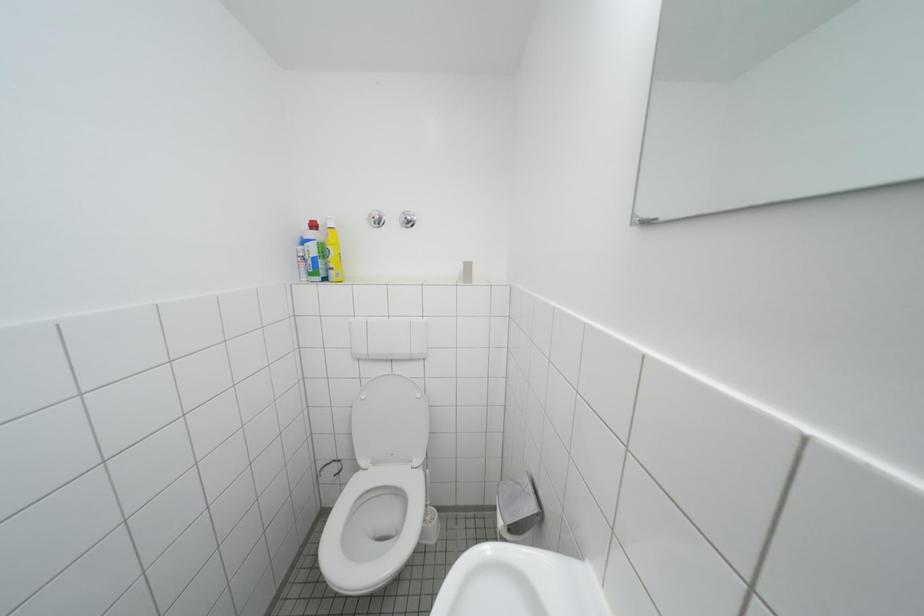
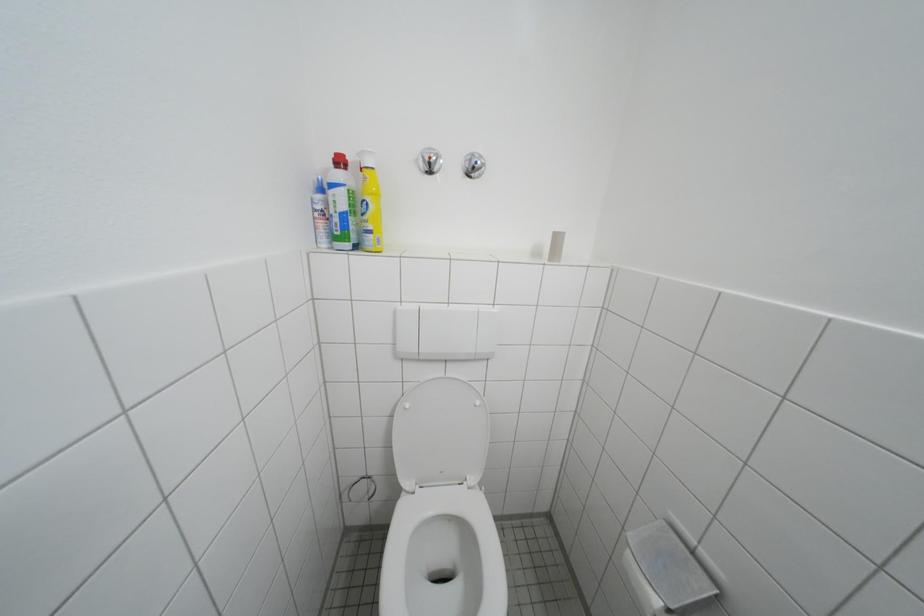
In a continuous first-person perspective shot, in which direction is the camera moving?

The movement direction of the cameraman is left, forward.